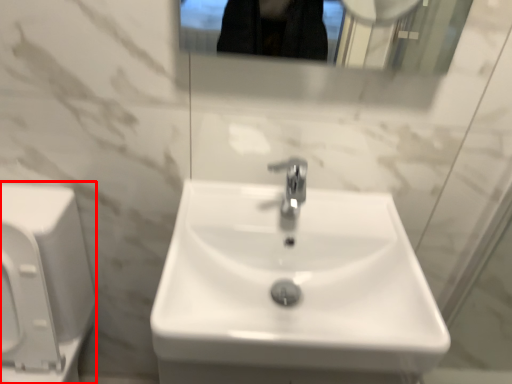
Question: From the image's perspective, what is the correct spatial relationship of porcelain (annotated by the red box) in relation to sink?

Choices:
 (A) above
 (B) below

Answer: (B)